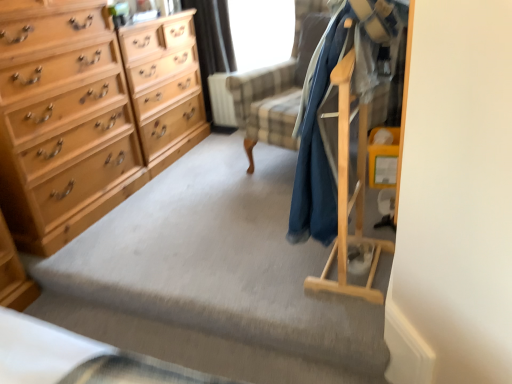
You are a GUI agent. You are given a task and a screenshot of the screen. Output one action in this format:
    pyautogui.click(x=<x>, y=<y>)
    Task: Click on the transparent plastic window screen at upper center
    
    Given the screenshot: What is the action you would take?
    261,32

Measure the distance between transparent plastic window screen at upper center and camera.

The depth of transparent plastic window screen at upper center is 8.82 feet.

What do you see at coordinates (165, 86) in the screenshot? I see `light wood/file cabinet at left` at bounding box center [165, 86].

Identify the location of light wood chest of drawers at left. (79, 120).

Is light wood/file cabinet at left aimed at black fabric curtain at upper center?

No, light wood/file cabinet at left is not facing towards black fabric curtain at upper center.

Does light wood/file cabinet at left contain black fabric curtain at upper center?

No, black fabric curtain at upper center is not a part of light wood/file cabinet at left.

Which is behind, light wood/file cabinet at left or black fabric curtain at upper center?

black fabric curtain at upper center is more distant.

Which object is positioned more to the left, light wood/file cabinet at left or black fabric curtain at upper center?

light wood/file cabinet at left.

There is a light wood/file cabinet at left. Identify the location of window screen above it (from a real-world perspective). The image size is (512, 384). (261, 32).

Considering the sizes of light wood/file cabinet at left and transparent plastic window screen at upper center in the image, is light wood/file cabinet at left taller or shorter than transparent plastic window screen at upper center?

Clearly, light wood/file cabinet at left is taller compared to transparent plastic window screen at upper center.

From a real-world perspective, who is located lower, light wood/file cabinet at left or transparent plastic window screen at upper center?

light wood/file cabinet at left.

Which of these two, light wood/file cabinet at left or transparent plastic window screen at upper center, is smaller?

Smaller between the two is transparent plastic window screen at upper center.

Considering the relative sizes of transparent plastic window screen at upper center and black fabric curtain at upper center in the image provided, is transparent plastic window screen at upper center taller than black fabric curtain at upper center?

No, transparent plastic window screen at upper center is not taller than black fabric curtain at upper center.

Is transparent plastic window screen at upper center not within black fabric curtain at upper center?

Absolutely, transparent plastic window screen at upper center is external to black fabric curtain at upper center.

From the image's perspective, is transparent plastic window screen at upper center located beneath black fabric curtain at upper center?

No.

Which is in front, point (279, 46) or point (200, 44)?

The point (279, 46) is more forward.

From a real-world perspective, is light wood chest of drawers at left physically located above or below transparent plastic window screen at upper center?

Clearly, from a real-world perspective, light wood chest of drawers at left is below transparent plastic window screen at upper center.

Considering the sizes of objects light wood chest of drawers at left and transparent plastic window screen at upper center in the image provided, who is smaller, light wood chest of drawers at left or transparent plastic window screen at upper center?

With smaller size is transparent plastic window screen at upper center.

Between light wood chest of drawers at left and transparent plastic window screen at upper center, which one appears on the right side from the viewer's perspective?

transparent plastic window screen at upper center.

Considering the positions of objects light wood chest of drawers at left and transparent plastic window screen at upper center in the image provided, who is in front, light wood chest of drawers at left or transparent plastic window screen at upper center?

Positioned in front is light wood chest of drawers at left.

From a real-world perspective, is dark blue fabric coat at right under black fabric curtain at upper center?

No, from a real-world perspective, dark blue fabric coat at right is not under black fabric curtain at upper center.

Is dark blue fabric coat at right positioned in front of black fabric curtain at upper center?

Yes.

From the image's perspective, between dark blue fabric coat at right and black fabric curtain at upper center, which one is located above?

black fabric curtain at upper center.

From their relative heights in the image, would you say dark blue fabric coat at right is taller or shorter than light wood chest of drawers at left?

In the image, dark blue fabric coat at right appears to be shorter than light wood chest of drawers at left.

Is dark blue fabric coat at right beside light wood chest of drawers at left?

They are not placed beside each other.

Who is smaller, dark blue fabric coat at right or light wood chest of drawers at left?

Smaller between the two is dark blue fabric coat at right.

At what (x,y) coordinates should I click in order to perform the action: click on the chest of drawers that is behind the dark blue fabric coat at right. Please return your answer as a coordinate pair (x, y). Looking at the image, I should click on (79, 120).

From a real-world perspective, is black fabric curtain at upper center on top of light wood/file cabinet at left?

Yes.

Which object is further away from the camera, black fabric curtain at upper center or light wood/file cabinet at left?

black fabric curtain at upper center is further away from the camera.

Is light wood/file cabinet at left inside black fabric curtain at upper center?

No.

Where is `curtain above the light wood/file cabinet at left (from the image's perspective)`? The width and height of the screenshot is (512, 384). curtain above the light wood/file cabinet at left (from the image's perspective) is located at coordinates (212, 44).

The height and width of the screenshot is (384, 512). In order to click on window screen that is above the light wood/file cabinet at left (from a real-world perspective) in this screenshot , I will do `click(261, 32)`.

Estimate the real-world distances between objects in this image. Which object is closer to black fabric curtain at upper center, dark blue fabric coat at right or light wood/file cabinet at left?

Among the two, light wood/file cabinet at left is located nearer to black fabric curtain at upper center.

Estimate the real-world distances between objects in this image. Which object is closer to dark blue fabric coat at right, transparent plastic window screen at upper center or light wood/file cabinet at left?

The object closer to dark blue fabric coat at right is light wood/file cabinet at left.

When comparing their distances from light wood/file cabinet at left, does dark blue fabric coat at right or light wood chest of drawers at left seem further?

dark blue fabric coat at right.

In the scene shown: Based on their spatial positions, is black fabric curtain at upper center or dark blue fabric coat at right closer to light wood/file cabinet at left?

black fabric curtain at upper center is closer to light wood/file cabinet at left.

When comparing their distances from black fabric curtain at upper center, does light wood/file cabinet at left or dark blue fabric coat at right seem closer?

light wood/file cabinet at left lies closer to black fabric curtain at upper center than the other object.

Looking at the image, which one is located closer to transparent plastic window screen at upper center, dark blue fabric coat at right or light wood/file cabinet at left?

Among the two, light wood/file cabinet at left is located nearer to transparent plastic window screen at upper center.

Considering their positions, is light wood chest of drawers at left positioned further to black fabric curtain at upper center than transparent plastic window screen at upper center?

light wood chest of drawers at left is positioned further to the anchor black fabric curtain at upper center.

When comparing their distances from black fabric curtain at upper center, does transparent plastic window screen at upper center or light wood chest of drawers at left seem further?

Among the two, light wood chest of drawers at left is located further to black fabric curtain at upper center.

You are a GUI agent. You are given a task and a screenshot of the screen. Output one action in this format:
    pyautogui.click(x=<x>, y=<y>)
    Task: Click on the file cabinet between light wood chest of drawers at left and dark blue fabric coat at right in the horizontal direction
    This screenshot has width=512, height=384.
    Given the screenshot: What is the action you would take?
    pyautogui.click(x=165, y=86)

Identify the location of file cabinet between dark blue fabric coat at right and transparent plastic window screen at upper center from front to back. The width and height of the screenshot is (512, 384). (165, 86).

Locate an element on the screen. the chest of drawers positioned between dark blue fabric coat at right and black fabric curtain at upper center from near to far is located at coordinates (79, 120).

Image resolution: width=512 pixels, height=384 pixels. I want to click on window screen between light wood/file cabinet at left and black fabric curtain at upper center along the z-axis, so click(261, 32).